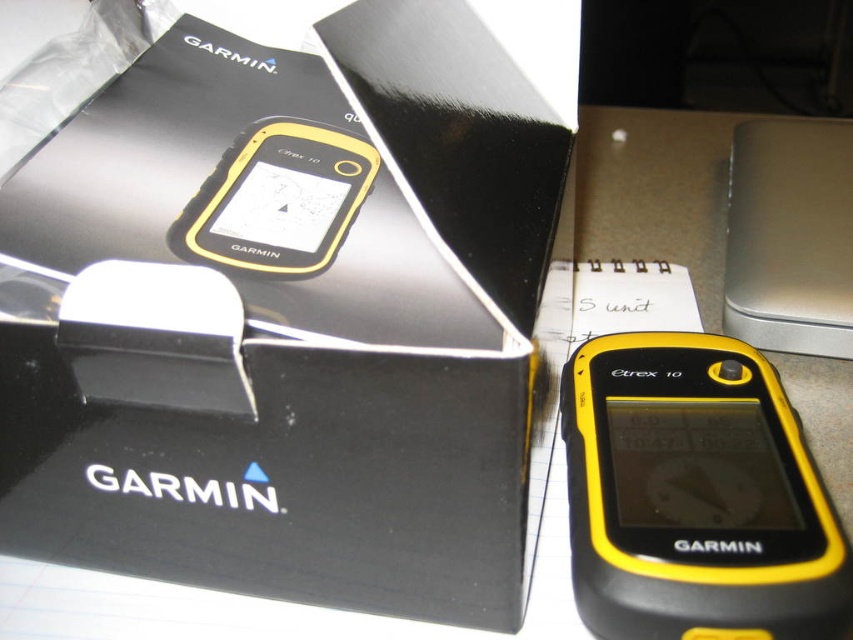
You are trying to locate the black matte box at center in the image. According to the coordinates provided, what is its position relative to the image frame?

The black matte box at center is located at point coordinates of approximately 0.489 on the x axis and 0.349 on the y axis within the image frame.